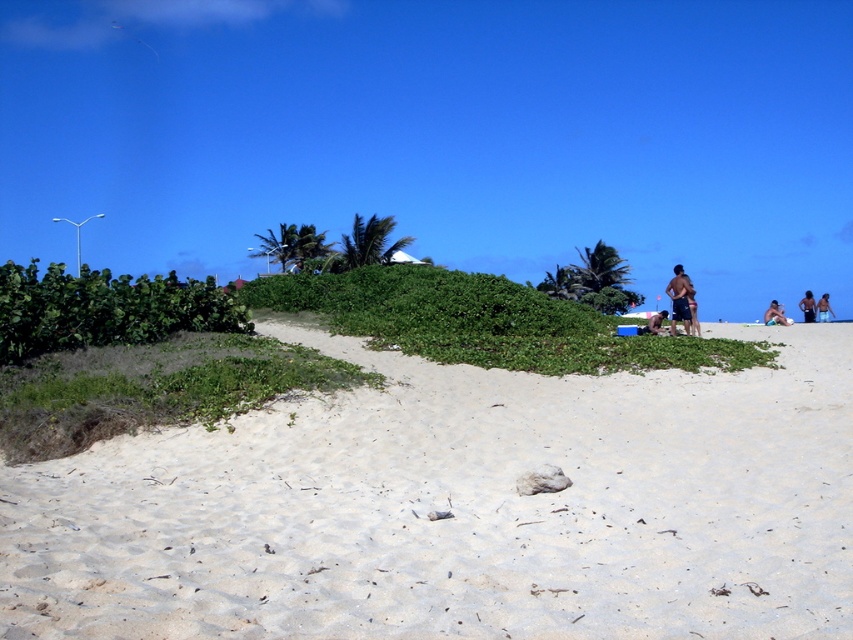
The width and height of the screenshot is (853, 640). What do you see at coordinates (486, 323) in the screenshot?
I see `green leafy bush at center` at bounding box center [486, 323].

The height and width of the screenshot is (640, 853). I want to click on green leafy bush at center, so [x=486, y=323].

Can you confirm if green leafy bush at center is wider than tan skin person at right?

In fact, green leafy bush at center might be narrower than tan skin person at right.

Between green leafy bush at center and tan skin person at right, which one has more height?

Standing taller between the two is tan skin person at right.

Where is `green leafy bush at center`? This screenshot has width=853, height=640. green leafy bush at center is located at coordinates (486, 323).

Can you confirm if tan skin person at upper right is smaller than brown fabric person at lower right?

No.

Is point (766, 316) in front of point (648, 326)?

No, (766, 316) is behind (648, 326).

You are a GUI agent. You are given a task and a screenshot of the screen. Output one action in this format:
    pyautogui.click(x=<x>, y=<y>)
    Task: Click on the tan skin person at upper right
    This screenshot has height=640, width=853.
    Given the screenshot: What is the action you would take?
    pyautogui.click(x=775, y=316)

Locate an element on the screen. Image resolution: width=853 pixels, height=640 pixels. tan skin person at upper right is located at coordinates (775, 316).